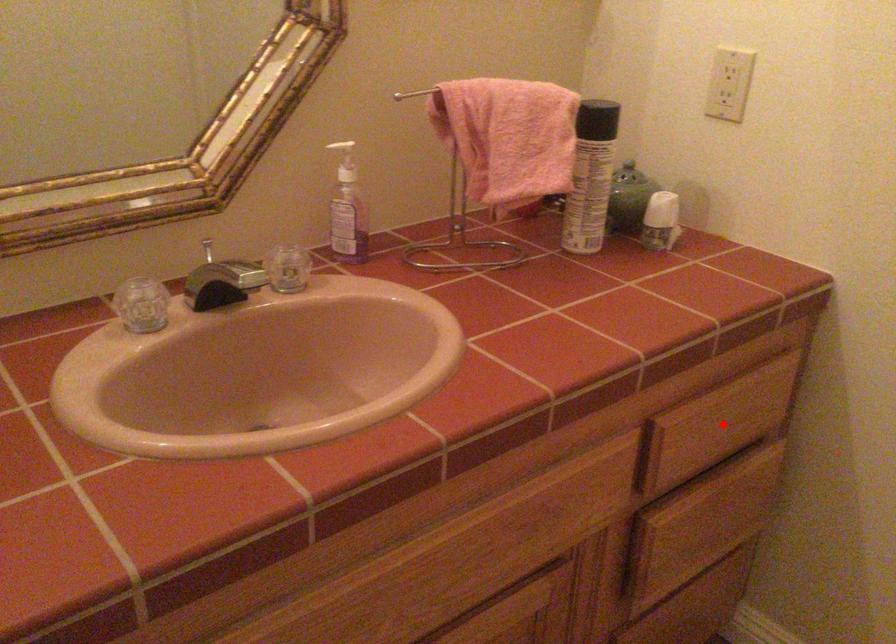
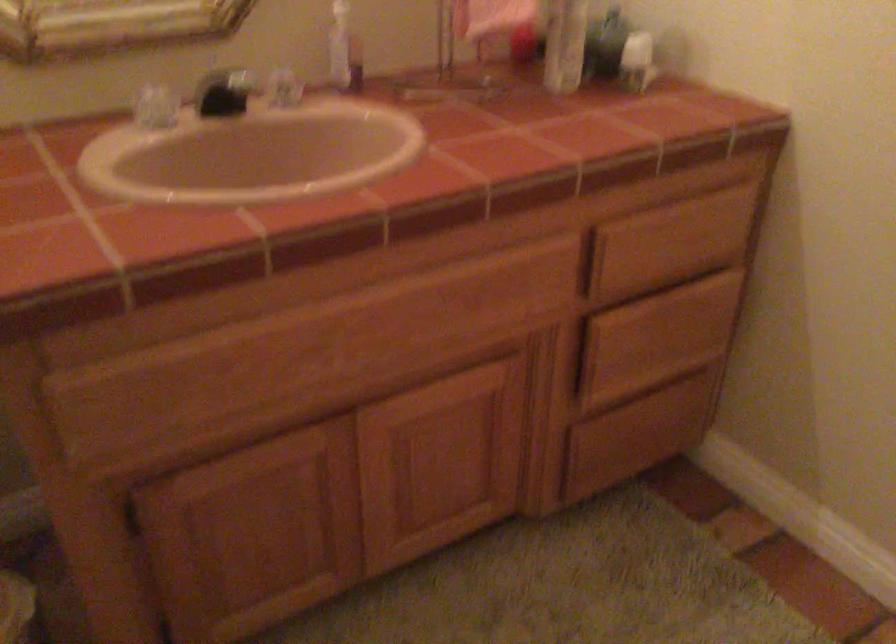
Question: A red point is marked in image1. In image2, is the corresponding 3D point closer to the camera or farther? Reply with the corresponding letter.

Choices:
 (A) The corresponding 3D point is closer.
 (B) The corresponding 3D point is farther.

Answer: (B)